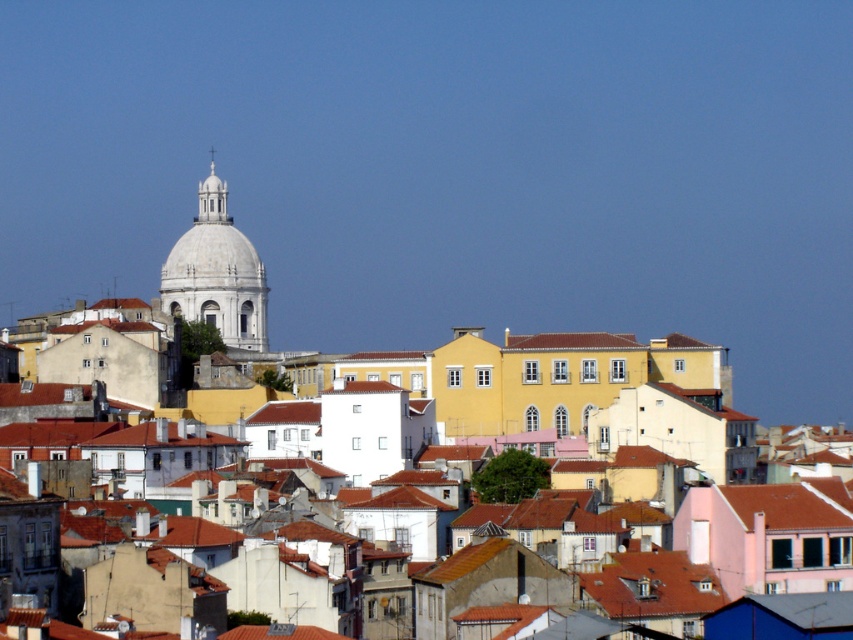
Is yellow matte building at center smaller than white marble dome at upper center?

Yes, yellow matte building at center is smaller than white marble dome at upper center.

Is point (622, 410) closer to camera compared to point (231, 264)?

Yes.

Who is more distant from viewer, (810, 490) or (194, 308)?

The point (194, 308) is behind.

Identify the location of yellow matte building at center. (647, 403).